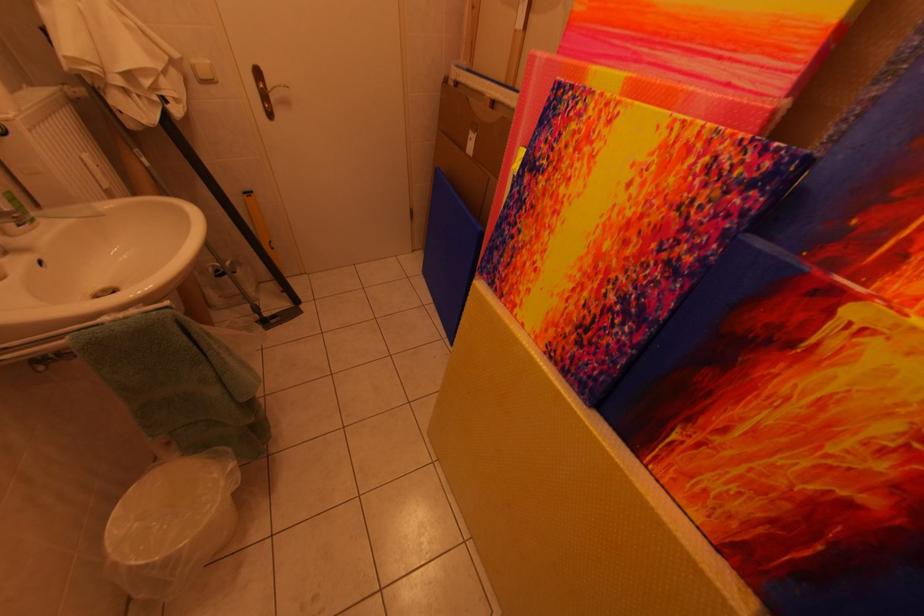
Where would you push the white light switch? Please return your answer as a coordinate pair (x, y).

(202, 71)